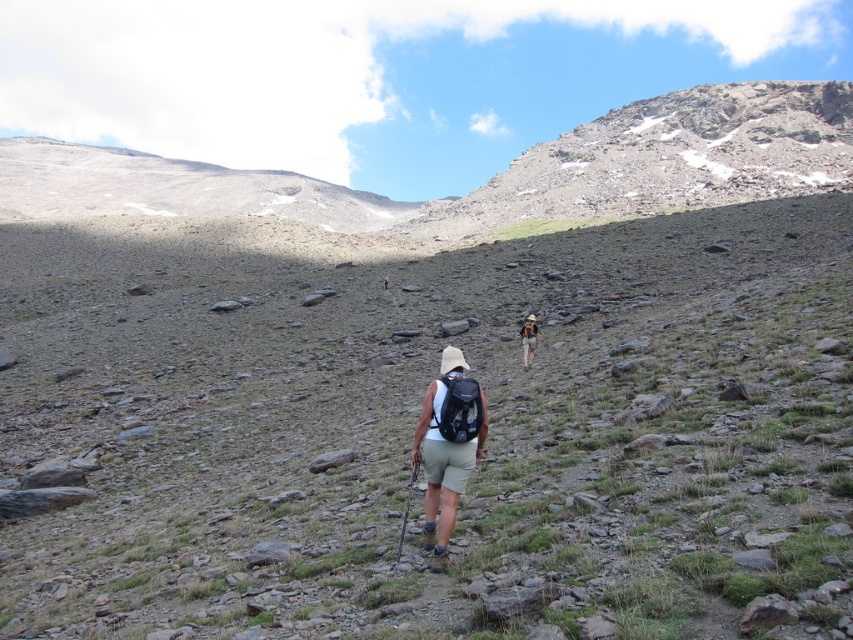
Which of these two, white fabric shorts at center or matte black backpack at center, stands taller?

white fabric shorts at center is taller.

Does white fabric shorts at center have a lesser width compared to matte black backpack at center?

In fact, white fabric shorts at center might be wider than matte black backpack at center.

The width and height of the screenshot is (853, 640). Find the location of `white fabric shorts at center`. white fabric shorts at center is located at coordinates (447, 445).

Is point (529, 336) less distant than point (387, 278)?

Yes.

What are the coordinates of `camouflage fabric backpack at center` in the screenshot? It's located at coord(527,339).

Does white fabric shorts at center appear over camouflage fabric backpack at center?

Actually, white fabric shorts at center is below camouflage fabric backpack at center.

Which is more to the left, white fabric shorts at center or camouflage fabric backpack at center?

white fabric shorts at center is more to the left.

What do you see at coordinates (447, 445) in the screenshot? The height and width of the screenshot is (640, 853). I see `white fabric shorts at center` at bounding box center [447, 445].

Identify the location of white fabric shorts at center. (447, 445).